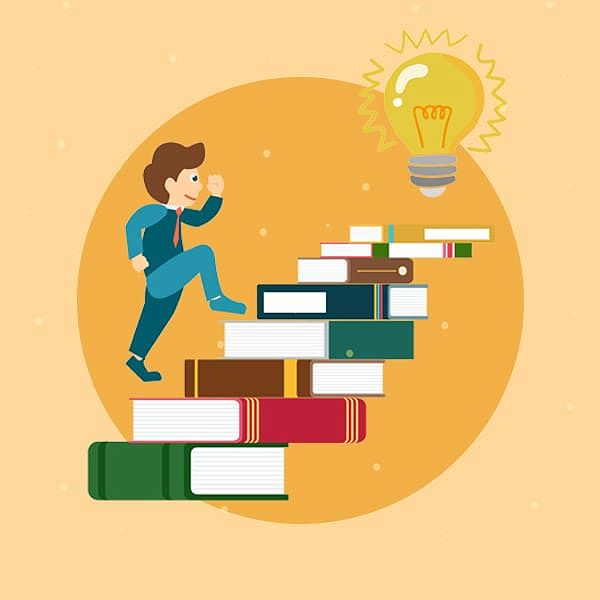
Find the location of a particular element. This screenshot has width=600, height=600. books is located at coordinates (187, 483), (267, 427), (315, 386), (322, 347), (321, 305), (353, 267), (375, 241), (410, 231).